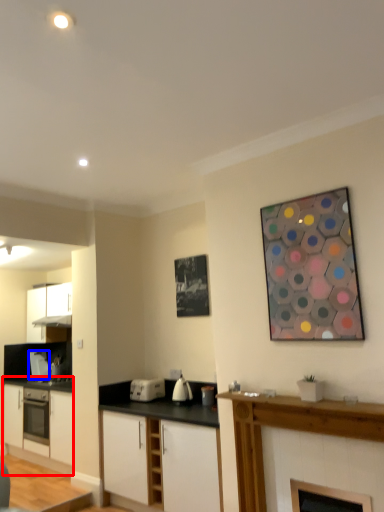
Question: Which object appears farthest to the camera in this image, cabinetry (highlighted by a red box) or appliance (highlighted by a blue box)?

Choices:
 (A) cabinetry
 (B) appliance

Answer: (B)